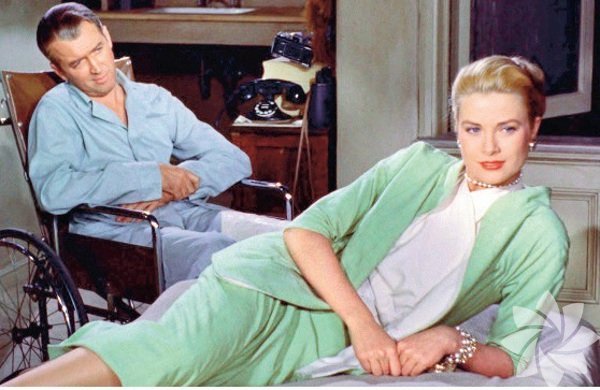
Identify the location of window. (549, 49).